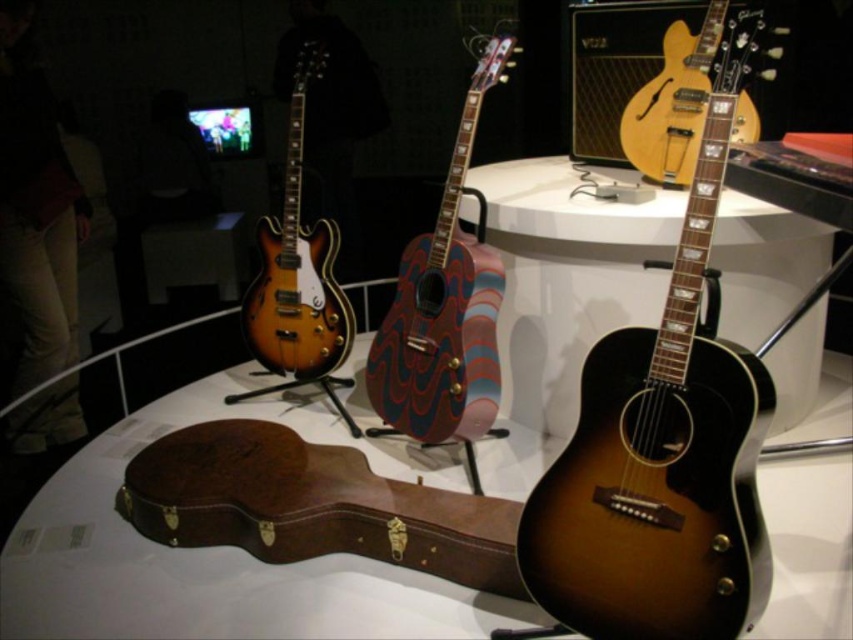
Which is above, multicolored wood acoustic guitar at center or sunburst wood electric guitar at upper right?

sunburst wood electric guitar at upper right is above.

Does multicolored wood acoustic guitar at center have a lesser height compared to sunburst wood electric guitar at upper right?

In fact, multicolored wood acoustic guitar at center may be taller than sunburst wood electric guitar at upper right.

What are the coordinates of `multicolored wood acoustic guitar at center` in the screenshot? It's located at (444, 308).

Does satin wood guitar at center lie in front of multicolored wood acoustic guitar at center?

Yes, satin wood guitar at center is in front of multicolored wood acoustic guitar at center.

Who is positioned more to the left, satin wood guitar at center or multicolored wood acoustic guitar at center?

multicolored wood acoustic guitar at center is more to the left.

Who is more forward, (718, 131) or (428, 417)?

Positioned in front is point (718, 131).

What are the coordinates of `satin wood guitar at center` in the screenshot? It's located at (664, 444).

Can you confirm if satin wood guitar at center is smaller than sunburst wood electric guitar at upper right?

No, satin wood guitar at center is not smaller than sunburst wood electric guitar at upper right.

Describe the element at coordinates (664, 444) in the screenshot. I see `satin wood guitar at center` at that location.

Locate an element on the screen. This screenshot has width=853, height=640. satin wood guitar at center is located at coordinates (664, 444).